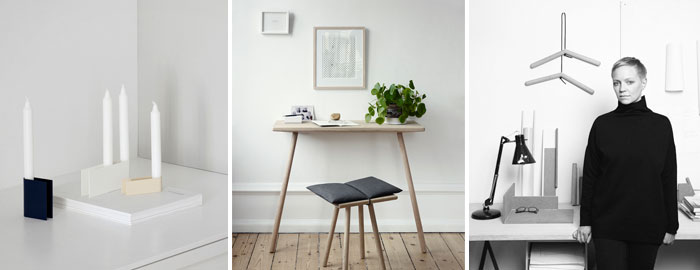
The height and width of the screenshot is (270, 700). In order to click on books in this screenshot , I will do 692,210, 329,133.